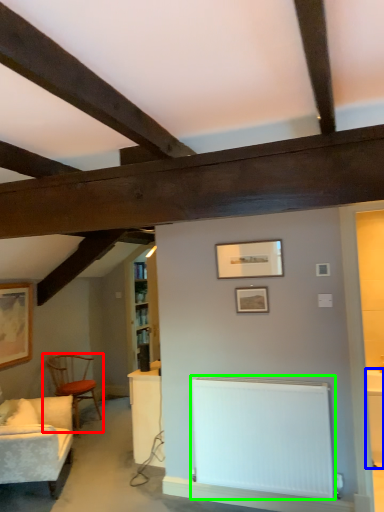
Question: Based on their relative distances, which object is nearer to chair (highlighted by a red box)? Choose from table (highlighted by a blue box) and radiator (highlighted by a green box).

Choices:
 (A) table
 (B) radiator

Answer: (B)